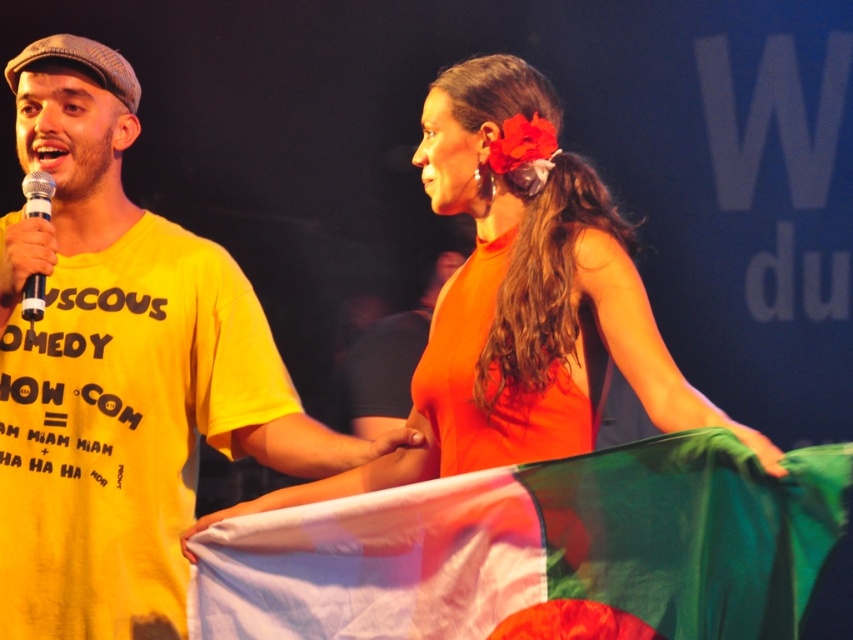
Question: Does metallic microphone at left have a greater width compared to silver metallic microphone at left?

Choices:
 (A) yes
 (B) no

Answer: (A)

Question: Which is nearer to the silver metallic microphone at left?

Choices:
 (A) orange matte tank top at center
 (B) orange fabric at center
 (C) metallic microphone at left

Answer: (C)

Question: Which point is closer to the camera?

Choices:
 (A) metallic microphone at left
 (B) silver metallic microphone at left
 (C) orange matte tank top at center

Answer: (C)

Question: Which object is closer to the camera taking this photo?

Choices:
 (A) orange fabric at center
 (B) yellow cotton t-shirt at left
 (C) metallic microphone at left
 (D) translucent fabric flag at lower center

Answer: (D)

Question: Does yellow cotton t-shirt at left appear over orange matte tank top at center?

Choices:
 (A) yes
 (B) no

Answer: (A)

Question: Can you confirm if translucent fabric flag at lower center is positioned to the left of orange fabric at center?

Choices:
 (A) yes
 (B) no

Answer: (B)